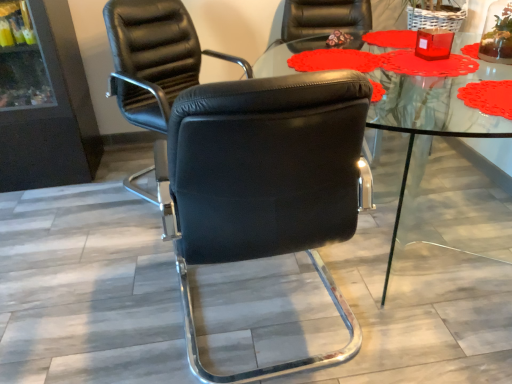
The height and width of the screenshot is (384, 512). In order to click on black leather chair at center, which ranks as the 2th chair in front-to-back order in this screenshot , I will do `click(154, 58)`.

Is black leather chair at center, the second chair when ordered from back to front, surrounding transparent glass table at center?

No, transparent glass table at center is not inside black leather chair at center, the second chair when ordered from back to front.

Considering the relative positions of black leather chair at center, the second chair when ordered from back to front, and transparent glass table at center in the image provided, is black leather chair at center, the second chair when ordered from back to front, to the left or to the right of transparent glass table at center?

black leather chair at center, the second chair when ordered from back to front, is to the left of transparent glass table at center.

Considering the sizes of objects black leather chair at center, the 1th chair from the front, and transparent glass table at center in the image provided, who is smaller, black leather chair at center, the 1th chair from the front, or transparent glass table at center?

black leather chair at center, the 1th chair from the front, is smaller.

From the image's perspective, which is below, black leather chair at center, which ranks as the 2th chair in front-to-back order, or transparent glass table at center?

transparent glass table at center appears lower in the image.

Choose the correct answer: Is black leather chair at center, which ranks as the 2th chair in front-to-back order, inside transparent glass table at center or outside it?

black leather chair at center, which ranks as the 2th chair in front-to-back order, is not inside transparent glass table at center, it's outside.

Can you tell me how much black leather chair at center, which ranks as the 2th chair in front-to-back order, and transparent glass table at center differ in facing direction?

37.7 degrees.

From a real-world perspective, which object rests below the other?

transparent glass table at center, from a real-world perspective.

Is transparent glass table at center touching black leather chair at center, which ranks as the 2th chair in front-to-back order?

No, transparent glass table at center is not next to black leather chair at center, which ranks as the 2th chair in front-to-back order.

Is transparent glass table at center oriented away from black leather chair at center, which ranks as the 2th chair in front-to-back order?

transparent glass table at center does not have its back to black leather chair at center, which ranks as the 2th chair in front-to-back order.

Between transparent glass table at center and black leather chair at center, which ranks as the 2th chair in front-to-back order, which one appears on the left side from the viewer's perspective?

black leather chair at center, which ranks as the 2th chair in front-to-back order.

Considering the positions of points (435, 188) and (336, 221), is point (435, 188) closer to camera compared to point (336, 221)?

No, (435, 188) is further to viewer.

Is black leather chair at center, the 1th chair from the front, a part of transparent glass table at center?

No, black leather chair at center, the 1th chair from the front, is not inside transparent glass table at center.

Which object is further away from the camera, black leather chair at center, the 1th chair from the front, or black leather chair at center, acting as the 1th chair starting from the back?

Positioned behind is black leather chair at center, acting as the 1th chair starting from the back.

Between point (322, 207) and point (173, 76), which one is positioned behind?

Point (173, 76)

Is black leather chair at center, the second chair when ordered from back to front, not near black leather chair at center, acting as the 1th chair starting from the back?

black leather chair at center, the second chair when ordered from back to front, is far away from black leather chair at center, acting as the 1th chair starting from the back.

Is black leather chair at center, acting as the 1th chair starting from the back, surrounded by black leather chair at center, the second chair when ordered from back to front?

No, black leather chair at center, the second chair when ordered from back to front, does not contain black leather chair at center, acting as the 1th chair starting from the back.

Considering the sizes of black leather chair at center, acting as the 1th chair starting from the back, and black leather chair at center, the 1th chair from the front, in the image, is black leather chair at center, acting as the 1th chair starting from the back, wider or thinner than black leather chair at center, the 1th chair from the front,?

black leather chair at center, acting as the 1th chair starting from the back, is thinner than black leather chair at center, the 1th chair from the front.

This screenshot has width=512, height=384. Find the location of `chair located above the black leather chair at center, the second chair when ordered from back to front (from a real-world perspective)`. chair located above the black leather chair at center, the second chair when ordered from back to front (from a real-world perspective) is located at coordinates (154, 58).

Does black leather chair at center, acting as the 1th chair starting from the back, touch black leather chair at center, the second chair when ordered from back to front?

No, black leather chair at center, acting as the 1th chair starting from the back, is not next to black leather chair at center, the second chair when ordered from back to front.

Is black leather chair at center, acting as the 1th chair starting from the back, smaller than black leather chair at center, the 1th chair from the front?

Actually, black leather chair at center, acting as the 1th chair starting from the back, might be larger than black leather chair at center, the 1th chair from the front.

You are a GUI agent. You are given a task and a screenshot of the screen. Output one action in this format:
    pyautogui.click(x=<x>, y=<y>)
    Task: Click on the 1st chair to the left when counting from the transparent glass table at center
    The image size is (512, 384).
    Given the screenshot: What is the action you would take?
    pyautogui.click(x=266, y=182)

You are a GUI agent. You are given a task and a screenshot of the screen. Output one action in this format:
    pyautogui.click(x=<x>, y=<y>)
    Task: Click on the chair above the transparent glass table at center (from the image's perspective)
    The height and width of the screenshot is (384, 512).
    Given the screenshot: What is the action you would take?
    pyautogui.click(x=154, y=58)

Considering their positions, is transparent glass table at center positioned closer to black leather chair at center, the 1th chair from the front, than black leather chair at center, acting as the 1th chair starting from the back?

transparent glass table at center is positioned closer to the anchor black leather chair at center, the 1th chair from the front.

Estimate the real-world distances between objects in this image. Which object is further from black leather chair at center, acting as the 1th chair starting from the back, transparent glass table at center or black leather chair at center, the 1th chair from the front?

The object further to black leather chair at center, acting as the 1th chair starting from the back, is transparent glass table at center.

From the image, which object appears to be farther from black leather chair at center, the second chair when ordered from back to front, black leather chair at center, which ranks as the 2th chair in front-to-back order, or transparent glass table at center?

Among the two, black leather chair at center, which ranks as the 2th chair in front-to-back order, is located further to black leather chair at center, the second chair when ordered from back to front.

Which object lies nearer to the anchor point transparent glass table at center, black leather chair at center, the 1th chair from the front, or black leather chair at center, which ranks as the 2th chair in front-to-back order?

black leather chair at center, the 1th chair from the front, is closer to transparent glass table at center.

In the scene shown: Which object lies further to the anchor point black leather chair at center, acting as the 1th chair starting from the back, black leather chair at center, the second chair when ordered from back to front, or transparent glass table at center?

transparent glass table at center is positioned further to the anchor black leather chair at center, acting as the 1th chair starting from the back.

Considering their positions, is black leather chair at center, which ranks as the 2th chair in front-to-back order, positioned further to transparent glass table at center than black leather chair at center, the 1th chair from the front?

Among the two, black leather chair at center, which ranks as the 2th chair in front-to-back order, is located further to transparent glass table at center.

You are a GUI agent. You are given a task and a screenshot of the screen. Output one action in this format:
    pyautogui.click(x=<x>, y=<y>)
    Task: Click on the chair between black leather chair at center, which ranks as the 2th chair in front-to-back order, and transparent glass table at center, in the horizontal direction
    Image resolution: width=512 pixels, height=384 pixels.
    Given the screenshot: What is the action you would take?
    pyautogui.click(x=266, y=182)